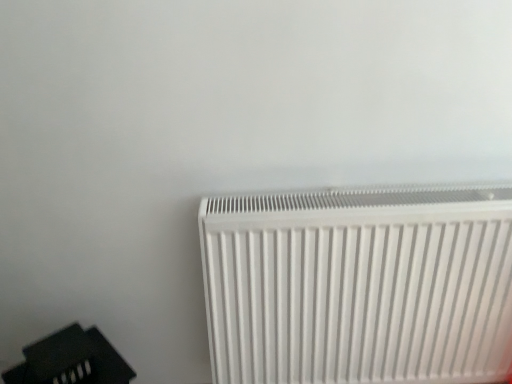
Question: Is point (498, 284) closer or farther from the camera than point (65, 370)?

Choices:
 (A) closer
 (B) farther

Answer: (A)

Question: Is white plastic radiator at lower right bigger or smaller than black plastic speaker at lower left?

Choices:
 (A) small
 (B) big

Answer: (B)

Question: Is white plastic radiator at lower right to the left or to the right of black plastic speaker at lower left in the image?

Choices:
 (A) left
 (B) right

Answer: (B)

Question: From the image's perspective, is black plastic speaker at lower left located above or below white plastic radiator at lower right?

Choices:
 (A) above
 (B) below

Answer: (B)

Question: In terms of size, does black plastic speaker at lower left appear bigger or smaller than white plastic radiator at lower right?

Choices:
 (A) small
 (B) big

Answer: (A)

Question: From a real-world perspective, is black plastic speaker at lower left positioned above or below white plastic radiator at lower right?

Choices:
 (A) above
 (B) below

Answer: (B)

Question: In terms of width, does black plastic speaker at lower left look wider or thinner when compared to white plastic radiator at lower right?

Choices:
 (A) wide
 (B) thin

Answer: (A)